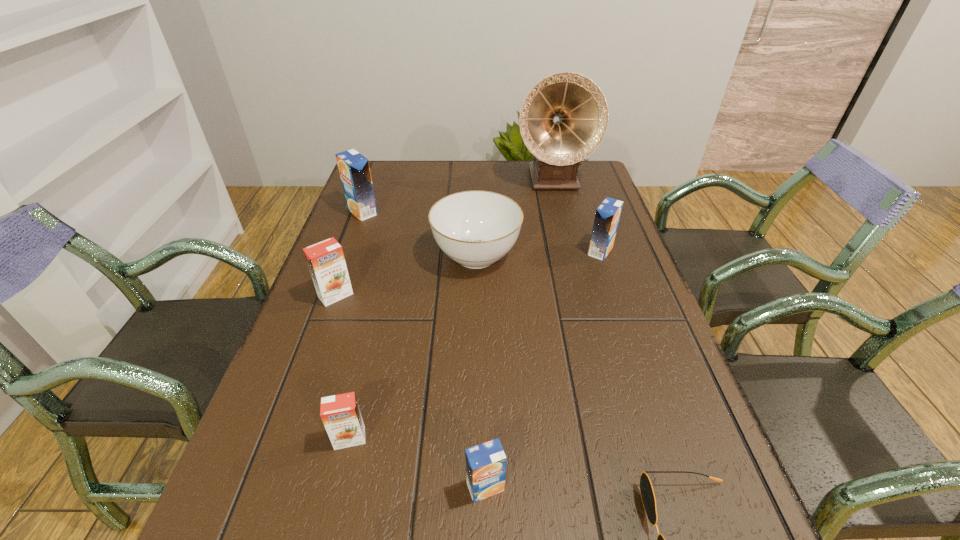
The width and height of the screenshot is (960, 540). Find the location of `empty location between the chinaware and the smallest blue orange_juice`. empty location between the chinaware and the smallest blue orange_juice is located at coordinates [481, 372].

Identify the location of vacant area that lies between the seventh nearest object and the right orange orange juice. (356, 325).

Image resolution: width=960 pixels, height=540 pixels. I want to click on free space between the left orange orange juice and the gray chinaware, so click(x=406, y=275).

Where is `free spot between the smallest blue orange_juice and the tallest orange_juice`? This screenshot has height=540, width=960. free spot between the smallest blue orange_juice and the tallest orange_juice is located at coordinates (424, 349).

Identify which object is the closest to the farther orange orange juice. Please provide its 2D coordinates. Your answer should be formatted as a tuple, i.e. [(x, y)], where the tuple contains the x and y coordinates of a point satisfying the conditions above.

[(474, 228)]

The width and height of the screenshot is (960, 540). I want to click on the fifth closest object to the gray chinaware, so click(x=340, y=414).

Where is `orange_juice identified as the fourth closest to the black sunglasses`? This screenshot has width=960, height=540. orange_juice identified as the fourth closest to the black sunglasses is located at coordinates (325, 259).

Find the location of a particular element. The image size is (960, 540). the second closest orange_juice to the second blue orange_juice from right to left is located at coordinates (325, 259).

At what (x,y) coordinates should I click in order to perform the action: click on the second closest blue orange_juice to the second blue orange_juice from right to left. Please return your answer as a coordinate pair (x, y). The width and height of the screenshot is (960, 540). Looking at the image, I should click on (354, 170).

Image resolution: width=960 pixels, height=540 pixels. What are the coordinates of `the closest blue orange_juice relative to the tallest object` in the screenshot? It's located at (607, 216).